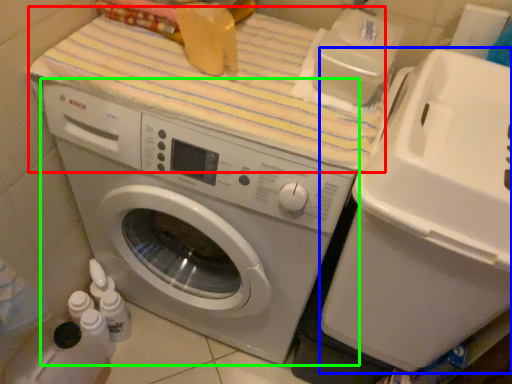
Question: Considering the real-world distances, which object is closest to bath towel (highlighted by a red box)? water cooler (highlighted by a blue box) or washing machine (highlighted by a green box).

Choices:
 (A) water cooler
 (B) washing machine

Answer: (B)